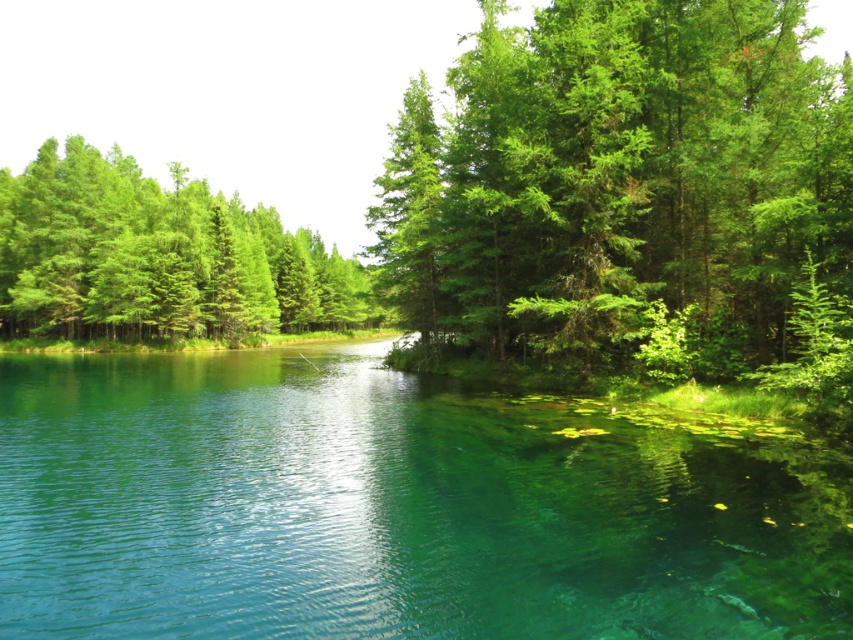
Does green leafy tree at upper center appear over green matte trees at upper left?

Actually, green leafy tree at upper center is below green matte trees at upper left.

Is point (619, 272) more distant than point (363, 272)?

That is False.

The height and width of the screenshot is (640, 853). I want to click on green leafy tree at upper center, so click(x=619, y=186).

Does transparent water at center have a larger size compared to green leafy tree at upper center?

No.

Identify the location of transparent water at center. (393, 508).

Is point (656, 536) positioned before point (262, 259)?

Yes, it is.

Who is more forward, (91, 572) or (210, 284)?

Positioned in front is point (91, 572).

The height and width of the screenshot is (640, 853). What do you see at coordinates (393, 508) in the screenshot? I see `transparent water at center` at bounding box center [393, 508].

Identify the location of transparent water at center. This screenshot has width=853, height=640. (393, 508).